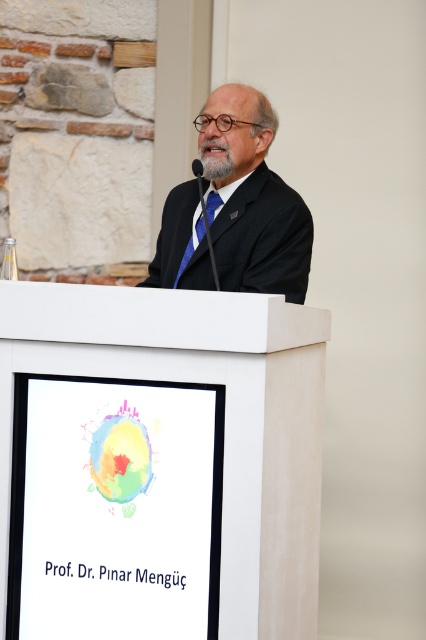
Between black matte suit at center and blue silk tie at center, which one has less height?

blue silk tie at center is shorter.

Image resolution: width=426 pixels, height=640 pixels. Describe the element at coordinates (250, 196) in the screenshot. I see `black matte suit at center` at that location.

This screenshot has height=640, width=426. What do you see at coordinates (250, 196) in the screenshot?
I see `black matte suit at center` at bounding box center [250, 196].

Locate an element on the screen. black matte suit at center is located at coordinates coord(250,196).

Is point (143, 538) more distant than point (198, 227)?

No, it is not.

Which is in front, point (71, 515) or point (212, 198)?

Point (71, 515) is in front.

The width and height of the screenshot is (426, 640). I want to click on white matte podium at center, so click(x=158, y=464).

The image size is (426, 640). I want to click on white matte podium at center, so click(x=158, y=464).

Who is taller, white matte podium at center or black matte suit at center?

white matte podium at center

What do you see at coordinates (158, 464) in the screenshot? The height and width of the screenshot is (640, 426). I see `white matte podium at center` at bounding box center [158, 464].

Find the location of a particular element. The width and height of the screenshot is (426, 640). white matte podium at center is located at coordinates (158, 464).